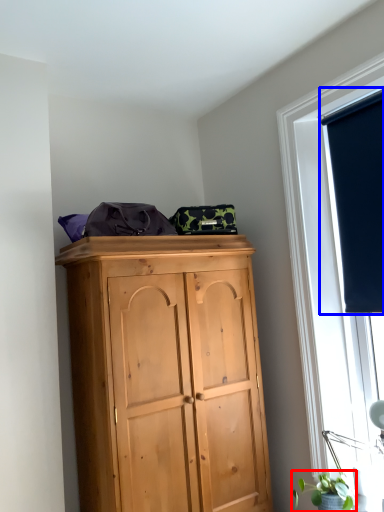
Question: Which point is closer to the camera, plant (highlighted by a red box) or window screen (highlighted by a blue box)?

Choices:
 (A) plant
 (B) window screen

Answer: (A)